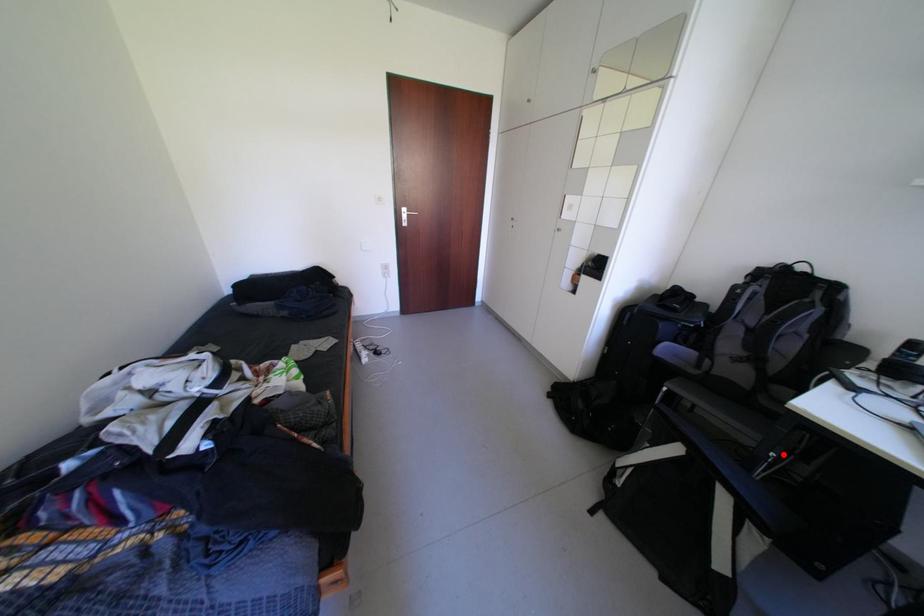
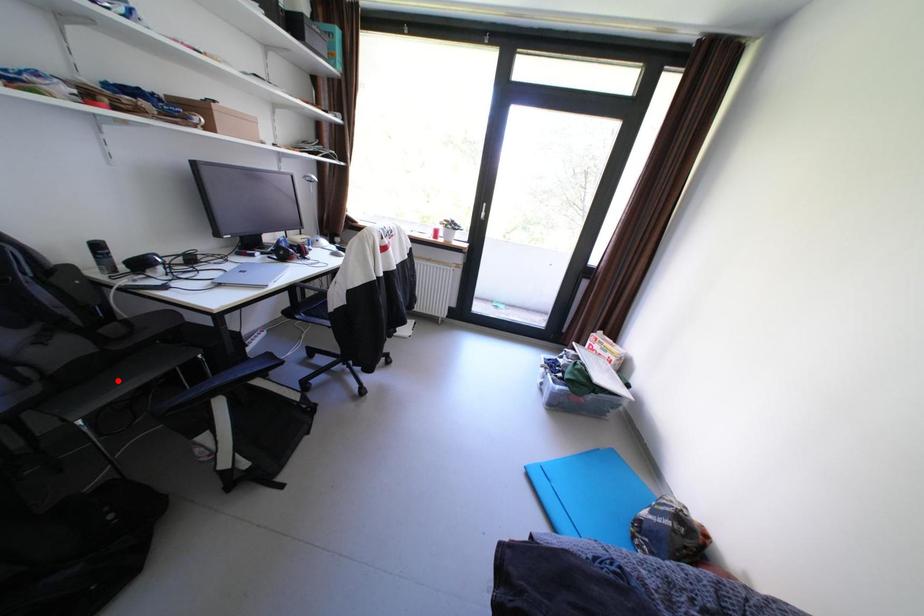
I am providing you with two images of the same scene from different viewpoints. A red point is marked on the first image and another point is marked on the second image. Is the red point in image1 aligned with the point shown in image2?

No